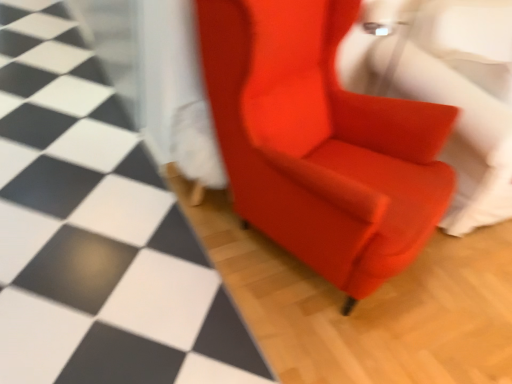
Question: From the image's perspective, is satin red armchair at center below matte red armchair at center?

Choices:
 (A) no
 (B) yes

Answer: (B)

Question: Is satin red armchair at center in front of matte red armchair at center?

Choices:
 (A) yes
 (B) no

Answer: (B)

Question: Can you confirm if satin red armchair at center is wider than matte red armchair at center?

Choices:
 (A) no
 (B) yes

Answer: (A)

Question: Can you confirm if satin red armchair at center is positioned to the left of matte red armchair at center?

Choices:
 (A) yes
 (B) no

Answer: (B)

Question: Does satin red armchair at center have a larger size compared to matte red armchair at center?

Choices:
 (A) no
 (B) yes

Answer: (B)

Question: Considering the relative positions of satin red armchair at center and matte red armchair at center in the image provided, is satin red armchair at center to the right of matte red armchair at center from the viewer's perspective?

Choices:
 (A) yes
 (B) no

Answer: (A)

Question: Can you confirm if satin red armchair at center is smaller than matte red armchair at center?

Choices:
 (A) yes
 (B) no

Answer: (B)

Question: Are satin red armchair at center and matte red armchair at center located far from each other?

Choices:
 (A) yes
 (B) no

Answer: (A)

Question: Considering the relative positions of satin red armchair at center and matte red armchair at center in the image provided, is satin red armchair at center to the left of matte red armchair at center from the viewer's perspective?

Choices:
 (A) no
 (B) yes

Answer: (A)

Question: From the image's perspective, does satin red armchair at center appear lower than matte red armchair at center?

Choices:
 (A) yes
 (B) no

Answer: (B)

Question: Does satin red armchair at center have a greater height compared to matte red armchair at center?

Choices:
 (A) yes
 (B) no

Answer: (A)

Question: Is satin red armchair at center touching matte red armchair at center?

Choices:
 (A) no
 (B) yes

Answer: (A)

Question: Can you see satin red armchair at center touching satin red armchair at center?

Choices:
 (A) yes
 (B) no

Answer: (B)